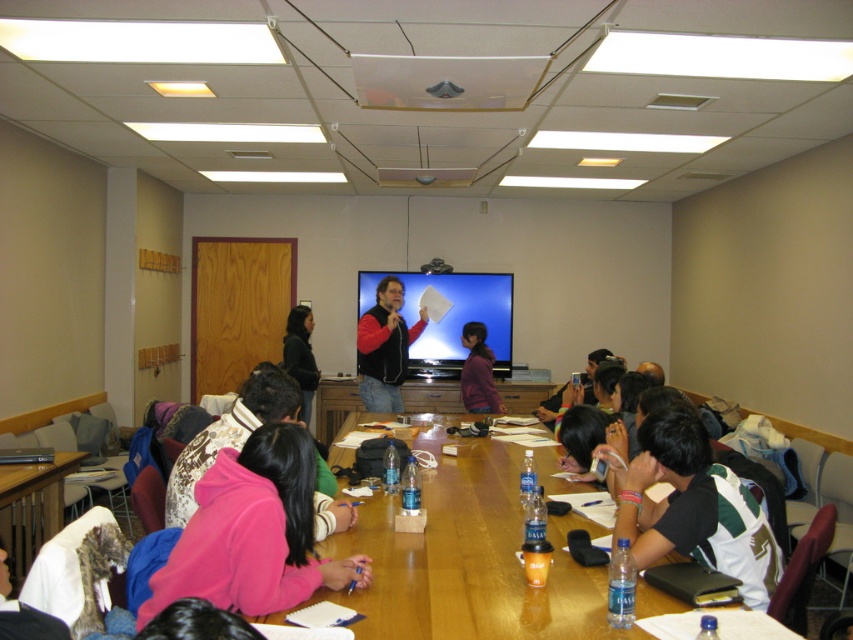
Question: Among these points, which one is nearest to the camera?

Choices:
 (A) (421, 570)
 (B) (467, 401)

Answer: (A)

Question: Does pink fleece jacket at lower center appear over matte black vest at center?

Choices:
 (A) yes
 (B) no

Answer: (B)

Question: Which of these objects is positioned closest to the wooden table at center?

Choices:
 (A) matte plastic screen at center
 (B) green jersey at center

Answer: (B)

Question: Observing the image, what is the correct spatial positioning of wooden table at center in reference to pink fleece jacket at lower left?

Choices:
 (A) right
 (B) left

Answer: (A)

Question: Estimate the real-world distances between objects in this image. Which object is farther from the purple matte shirt at center?

Choices:
 (A) pink fleece jacket at lower center
 (B) black plastic projector at upper center

Answer: (A)

Question: Is wooden table at center further to the viewer compared to pink fleece jacket at lower center?

Choices:
 (A) no
 (B) yes

Answer: (A)